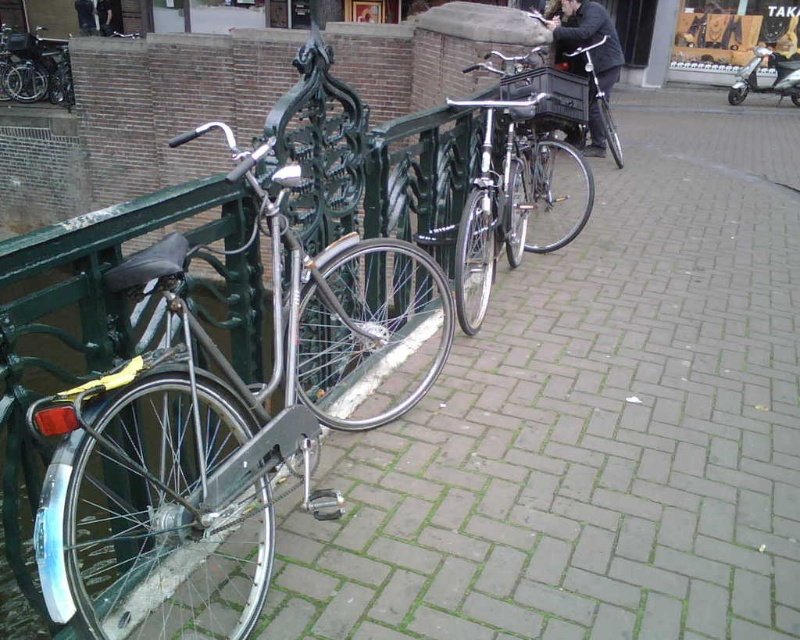
Question: Which object appears closest to the camera in this image?

Choices:
 (A) dark gray fabric pants at upper left
 (B) shiny silver bicycle at center

Answer: (B)

Question: Which point is closer to the camera?

Choices:
 (A) shiny silver bicycle at left
 (B) dark gray fabric pants at upper left

Answer: (A)

Question: Can you confirm if shiny silver bicycle at center is positioned above dark gray fabric pants at upper left?

Choices:
 (A) no
 (B) yes

Answer: (A)

Question: Does shiny silver bicycle at left appear on the right side of black fabric jacket at upper center?

Choices:
 (A) yes
 (B) no

Answer: (B)

Question: Among these objects, which one is farthest from the camera?

Choices:
 (A) dark gray fabric pants at upper left
 (B) shiny silver bicycle at left

Answer: (A)

Question: Where is shiny silver bicycle at left located in relation to shiny silver bicycle at center in the image?

Choices:
 (A) below
 (B) above

Answer: (A)